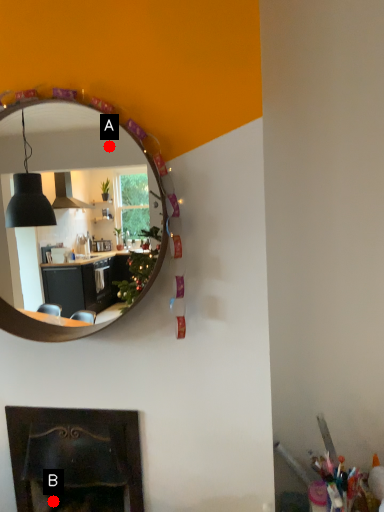
Question: Two points are circled on the image, labeled by A and B beside each circle. Which point is farther from the camera taking this photo?

Choices:
 (A) A is further
 (B) B is further

Answer: (A)